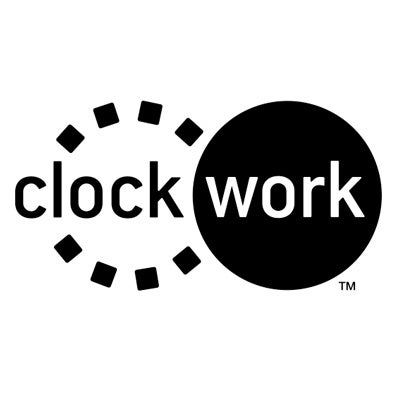
At what (x,y) coordinates should I click in order to perform the action: click on clock. Please return your answer as a coordinate pair (x, y). This screenshot has width=400, height=400. Looking at the image, I should click on (96, 201).